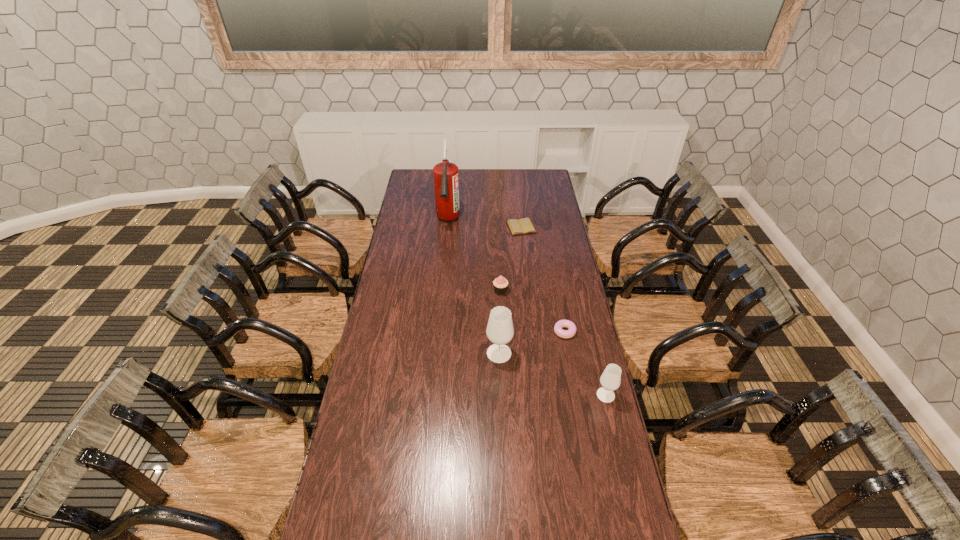
The width and height of the screenshot is (960, 540). Find the location of `vacant area between the second nearest object and the fifth object from left to right`. vacant area between the second nearest object and the fifth object from left to right is located at coordinates (532, 342).

Locate an element on the screen. unoccupied area between the fourth object from left to right and the rightmost object is located at coordinates 564,311.

Locate an element on the screen. This screenshot has width=960, height=540. object that is the closest to the nearest object is located at coordinates (560, 324).

The width and height of the screenshot is (960, 540). Find the location of `object that is the fourth nearest to the tallest object`. object that is the fourth nearest to the tallest object is located at coordinates (560, 324).

Where is `vacant region that satisfies the following two spatial constraints: 1. at the nozzle of the left glass; 2. on the left side of the tallest object`? vacant region that satisfies the following two spatial constraints: 1. at the nozzle of the left glass; 2. on the left side of the tallest object is located at coordinates (435, 353).

Locate an element on the screen. free spot that satisfies the following two spatial constraints: 1. on the back side of the second tallest object; 2. on the left side of the diary is located at coordinates (494, 227).

The height and width of the screenshot is (540, 960). I want to click on blank space that satisfies the following two spatial constraints: 1. at the nozzle of the leftmost object; 2. on the right side of the shortest object, so click(x=447, y=227).

This screenshot has height=540, width=960. Identify the location of free space that satisfies the following two spatial constraints: 1. at the nozzle of the third nearest object; 2. on the left side of the tallest object. (438, 332).

In order to click on blank space that satisfies the following two spatial constraints: 1. on the back side of the left glass; 2. on the left side of the fifth tallest object in this screenshot , I will do `click(498, 332)`.

Locate an element on the screen. vacant space that satisfies the following two spatial constraints: 1. at the nozzle of the shorter glass; 2. on the right side of the leftmost object is located at coordinates click(431, 395).